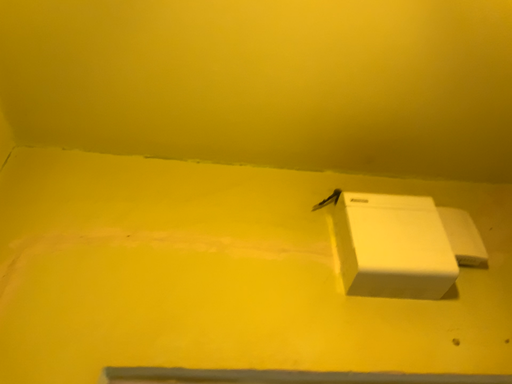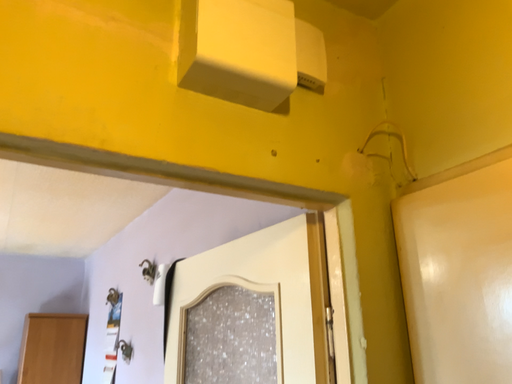
Question: How did the camera likely rotate when shooting the video?

Choices:
 (A) rotated right
 (B) rotated left

Answer: (A)